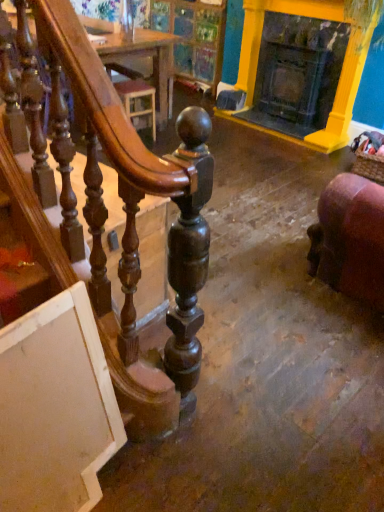
What is the approximate height of wooden table at upper center?

It is 19.22 inches.

Image resolution: width=384 pixels, height=512 pixels. What do you see at coordinates (350, 239) in the screenshot? I see `purple velvet chair at lower right` at bounding box center [350, 239].

What do you see at coordinates (299, 57) in the screenshot?
I see `yellow painted wood fireplace at upper right` at bounding box center [299, 57].

The height and width of the screenshot is (512, 384). In order to click on wooden table at upper center in this screenshot , I will do `click(141, 57)`.

Between yellow painted wood fireplace at upper right and purple velvet chair at lower right, which one has larger width?

purple velvet chair at lower right is wider.

Consider the image. From their relative heights in the image, would you say yellow painted wood fireplace at upper right is taller or shorter than purple velvet chair at lower right?

In the image, yellow painted wood fireplace at upper right appears to be taller than purple velvet chair at lower right.

Are yellow painted wood fireplace at upper right and purple velvet chair at lower right beside each other?

No, yellow painted wood fireplace at upper right is not with purple velvet chair at lower right.

Is yellow painted wood fireplace at upper right facing away from purple velvet chair at lower right?

No, yellow painted wood fireplace at upper right's orientation is not away from purple velvet chair at lower right.

Consider the image. From a real-world perspective, which is physically below, purple velvet chair at lower right or wooden table at upper center?

wooden table at upper center is physically lower.

Which object is closer to the camera, purple velvet chair at lower right or wooden table at upper center?

purple velvet chair at lower right is in front.

Who is smaller, purple velvet chair at lower right or wooden table at upper center?

wooden table at upper center is smaller.

Would you consider wooden table at upper center to be distant from yellow painted wood fireplace at upper right?

wooden table at upper center is far away from yellow painted wood fireplace at upper right.

Is wooden table at upper center positioned with its back to yellow painted wood fireplace at upper right?

wooden table at upper center does not have its back to yellow painted wood fireplace at upper right.

Who is taller, wooden table at upper center or yellow painted wood fireplace at upper right?

With more height is yellow painted wood fireplace at upper right.

Is wooden table at upper center outside of yellow painted wood fireplace at upper right?

Absolutely, wooden table at upper center is external to yellow painted wood fireplace at upper right.

Does purple velvet chair at lower right come behind yellow painted wood fireplace at upper right?

No.

Measure the distance from purple velvet chair at lower right to yellow painted wood fireplace at upper right.

They are 2.25 meters apart.

Is purple velvet chair at lower right inside the boundaries of yellow painted wood fireplace at upper right, or outside?

purple velvet chair at lower right cannot be found inside yellow painted wood fireplace at upper right.

Considering the sizes of objects purple velvet chair at lower right and yellow painted wood fireplace at upper right in the image provided, who is bigger, purple velvet chair at lower right or yellow painted wood fireplace at upper right?

With larger size is purple velvet chair at lower right.

How distant is yellow painted wood fireplace at upper right from wooden table at upper center?

yellow painted wood fireplace at upper right is 3.92 feet away from wooden table at upper center.

Is yellow painted wood fireplace at upper right further to camera compared to wooden table at upper center?

No.

Considering the sizes of yellow painted wood fireplace at upper right and wooden table at upper center in the image, is yellow painted wood fireplace at upper right taller or shorter than wooden table at upper center?

Clearly, yellow painted wood fireplace at upper right is taller compared to wooden table at upper center.

How different are the orientations of yellow painted wood fireplace at upper right and wooden table at upper center in degrees?

There is a 8.58-degree angle between the facing directions of yellow painted wood fireplace at upper right and wooden table at upper center.

From the image's perspective, is wooden table at upper center above or below purple velvet chair at lower right?

Clearly, from the image's perspective, wooden table at upper center is above purple velvet chair at lower right.

Which is less distant, (163, 38) or (368, 217)?

The point (368, 217) is more forward.

Which object is positioned more to the right, wooden table at upper center or purple velvet chair at lower right?

purple velvet chair at lower right.

Is wooden table at upper center taller or shorter than purple velvet chair at lower right?

Clearly, wooden table at upper center is shorter compared to purple velvet chair at lower right.

Find the location of `furniture below the yellow painted wood fireplace at upper right (from the image's perspective)`. furniture below the yellow painted wood fireplace at upper right (from the image's perspective) is located at coordinates (350, 239).

The image size is (384, 512). I want to click on furniture on the right of wooden table at upper center, so click(350, 239).

Estimate the real-world distances between objects in this image. Which object is further from purple velvet chair at lower right, yellow painted wood fireplace at upper right or wooden table at upper center?

Among the two, wooden table at upper center is located further to purple velvet chair at lower right.

Considering their positions, is purple velvet chair at lower right positioned further to wooden table at upper center than yellow painted wood fireplace at upper right?

Based on the image, purple velvet chair at lower right appears to be further to wooden table at upper center.

Looking at the image, which one is located further to yellow painted wood fireplace at upper right, purple velvet chair at lower right or wooden table at upper center?

purple velvet chair at lower right lies further to yellow painted wood fireplace at upper right than the other object.

Which object lies nearer to the anchor point purple velvet chair at lower right, wooden table at upper center or yellow painted wood fireplace at upper right?

yellow painted wood fireplace at upper right.

Based on their spatial positions, is yellow painted wood fireplace at upper right or purple velvet chair at lower right further from wooden table at upper center?

The object further to wooden table at upper center is purple velvet chair at lower right.

Estimate the real-world distances between objects in this image. Which object is further from yellow painted wood fireplace at upper right, wooden table at upper center or purple velvet chair at lower right?

purple velvet chair at lower right is positioned further to the anchor yellow painted wood fireplace at upper right.

I want to click on fireplace between purple velvet chair at lower right and wooden table at upper center from front to back, so click(299, 57).